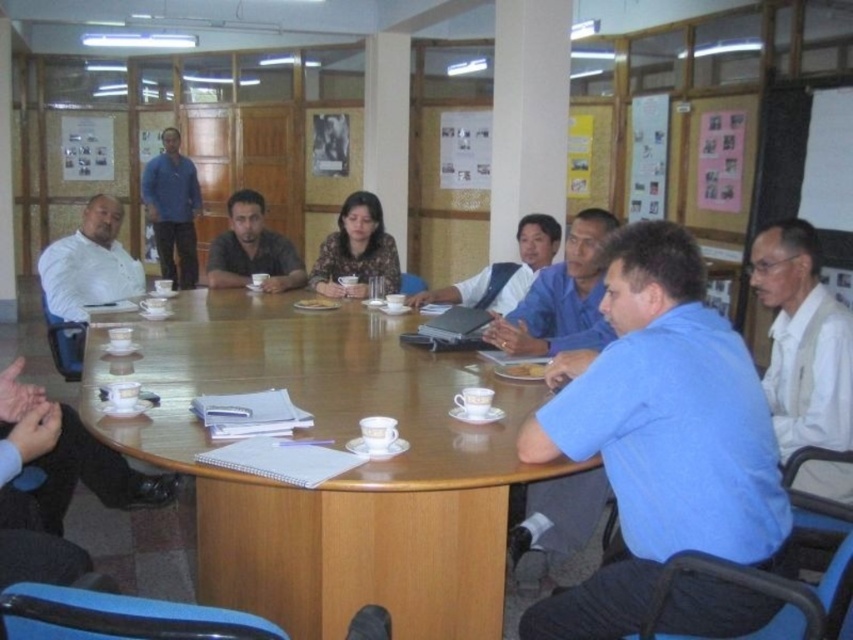
Question: Is blue cotton shirt at center to the right of white matte shirt at upper left from the viewer's perspective?

Choices:
 (A) no
 (B) yes

Answer: (B)

Question: Which is nearer to the wooden at center?

Choices:
 (A) matte black shirt at center
 (B) blue shirt at center

Answer: (B)

Question: Which object is positioned closest to the matte black shirt at center?

Choices:
 (A) white matte shirt at upper left
 (B) wooden at center

Answer: (A)

Question: Is blue cotton shirt at center below white matte shirt at upper left?

Choices:
 (A) no
 (B) yes

Answer: (B)

Question: Based on their relative distances, which object is farther from the blue cotton shirt at upper left?

Choices:
 (A) blue shirt at center
 (B) white textured shirt at right
 (C) blue cotton shirt at center

Answer: (C)

Question: Can you confirm if white textured shirt at right is bigger than blue fabric shirt at center?

Choices:
 (A) yes
 (B) no

Answer: (B)